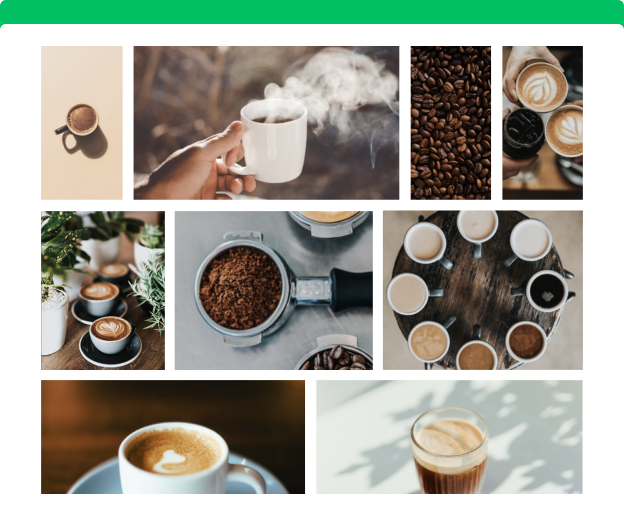
Find the location of `gray cup handles`. gray cup handles is located at coordinates (505, 322), (515, 293), (509, 261), (479, 249), (447, 264), (439, 292), (447, 322), (477, 332).